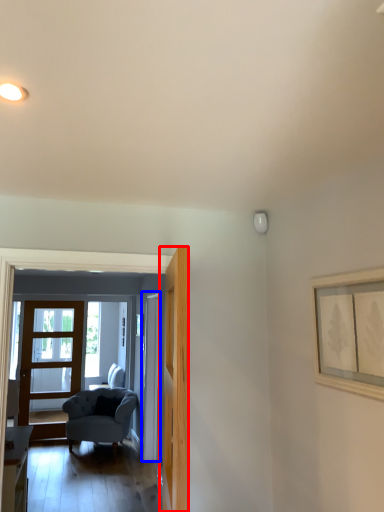
Question: Which of the following is the closest to the observer, door (highlighted by a red box) or door (highlighted by a blue box)?

Choices:
 (A) door
 (B) door

Answer: (A)